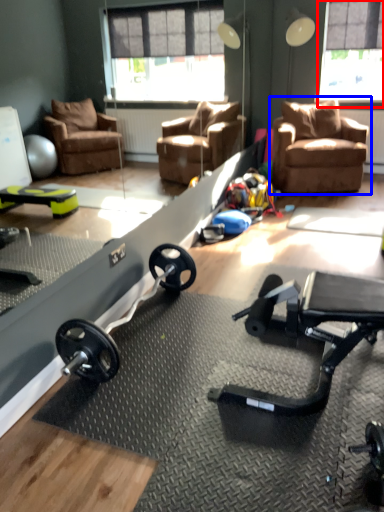
Question: Which of the following is the farthest to the observer, window screen (highlighted by a red box) or chair (highlighted by a blue box)?

Choices:
 (A) window screen
 (B) chair

Answer: (A)